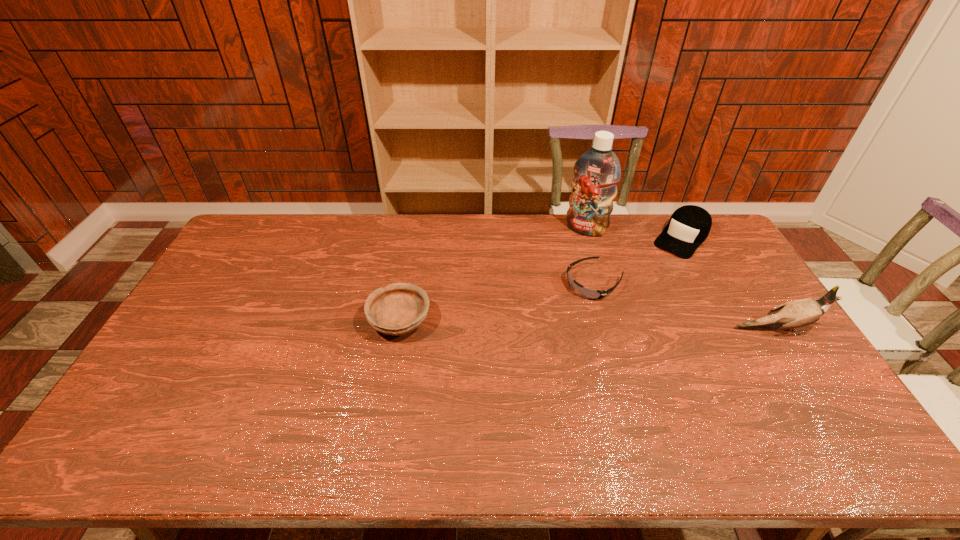
At what (x,y) coordinates should I click in order to perform the action: click on bowl. Please return your answer as a coordinate pair (x, y). Looking at the image, I should click on (400, 308).

You are a GUI agent. You are given a task and a screenshot of the screen. Output one action in this format:
    pyautogui.click(x=<x>, y=<y>)
    Task: Click on the fourth tallest object
    
    Given the screenshot: What is the action you would take?
    pyautogui.click(x=400, y=308)

Identify the location of bird. (798, 313).

At what (x,y) coordinates should I click in order to perform the action: click on the shortest object. Please return your answer as a coordinate pair (x, y). This screenshot has width=960, height=540. Looking at the image, I should click on (591, 294).

The width and height of the screenshot is (960, 540). In order to click on the tallest object in this screenshot , I will do `click(597, 171)`.

Identify the location of the third shortest object. (689, 226).

At what (x,y) coordinates should I click in order to perform the action: click on vacant space situated on the left of the leftmost object. Please return your answer as a coordinate pair (x, y). Looking at the image, I should click on (245, 321).

Identify the location of vacant space located on the lenses of the sunglasses. (553, 313).

Find the location of a particular element. free location located 0.320m on the lenses of the sunglasses is located at coordinates (505, 348).

This screenshot has height=540, width=960. Find the location of `free location located 0.240m on the lenses of the sunglasses`. free location located 0.240m on the lenses of the sunglasses is located at coordinates (524, 334).